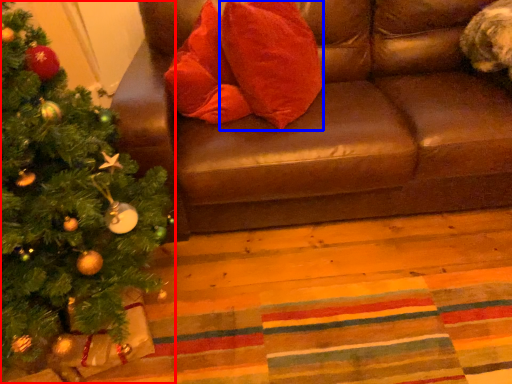
Question: Which object appears closest to the camera in this image, christmas tree (highlighted by a red box) or throw pillow (highlighted by a blue box)?

Choices:
 (A) christmas tree
 (B) throw pillow

Answer: (A)